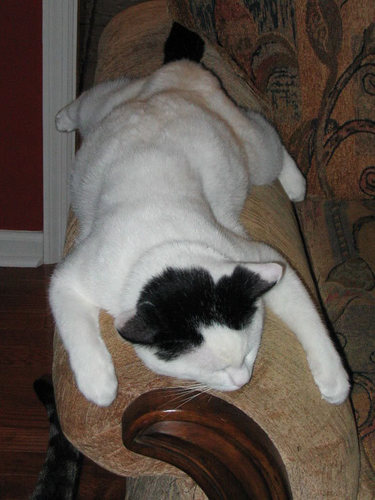
Where is `wooden part of sofa`? wooden part of sofa is located at coordinates (208, 446).